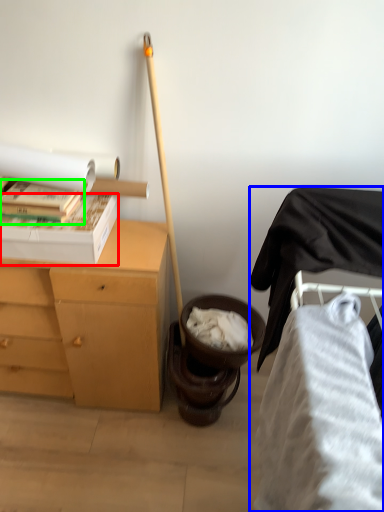
Question: Which object is the farthest from box (highlighted by a red box)? Choose among these: furniture (highlighted by a blue box) or book (highlighted by a green box).

Choices:
 (A) furniture
 (B) book

Answer: (A)